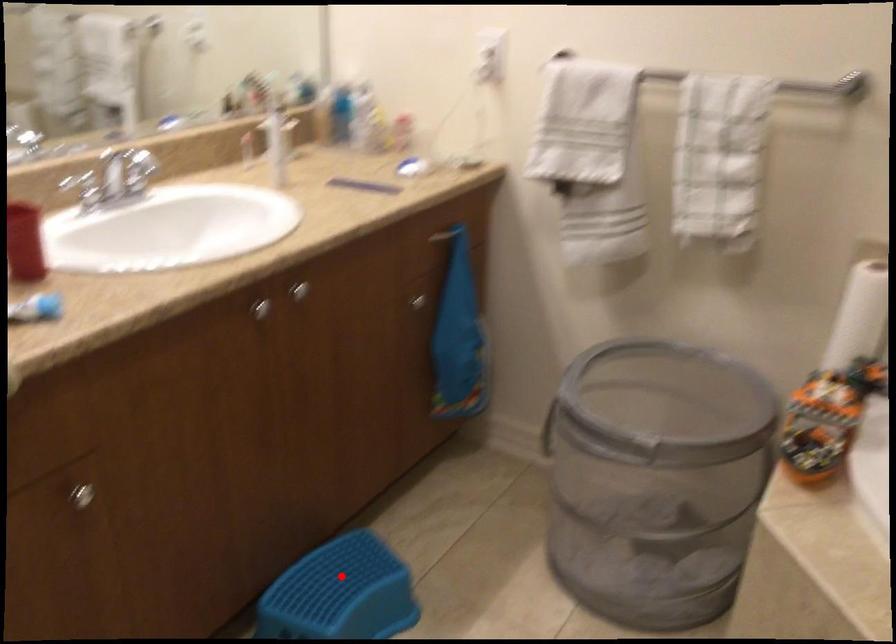
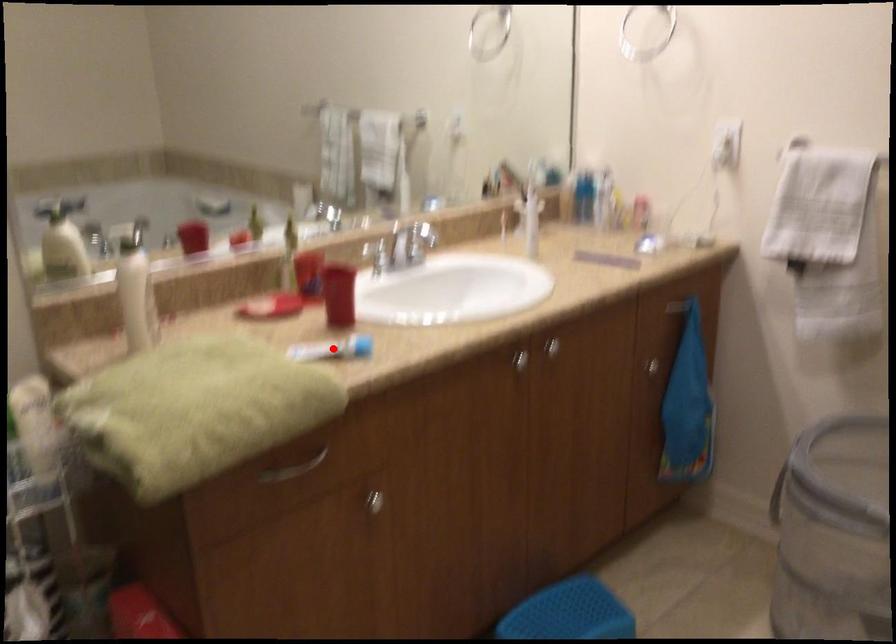
I am providing you with two images of the same scene from different viewpoints. A red point is marked on the first image and another point is marked on the second image. Does the point marked in image1 correspond to the same location as the one in image2?

No